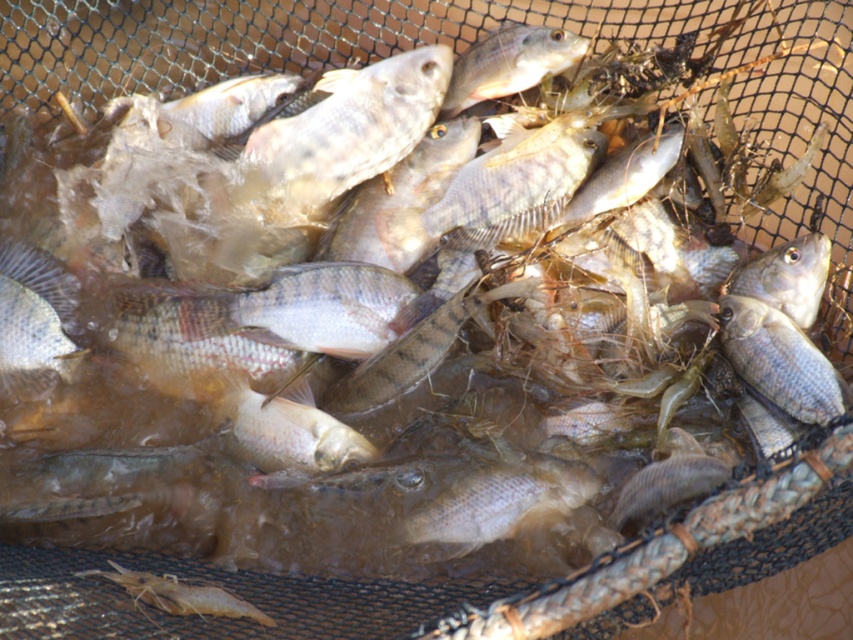
Consider the image. You are an observer looking at the fish in the net. Which fish is positioned to the left of the other between the slightly translucent silver fish at center and the shiny silver fish at center?

The slightly translucent silver fish at center is positioned to the left of the shiny silver fish at center.

You are a marine biologist examining a fishing net with two types of fish. You observe a slightly translucent silver fish at center and a shiny silver fish at center. Which of these two fish is smaller?

The slightly translucent silver fish at center is smaller than the shiny silver fish at center according to the description.